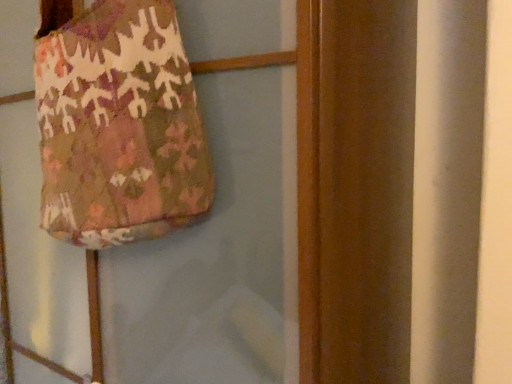
Question: In the image, is textured fabric bag at upper left positioned in front of or behind textured fabric bag at upper left?

Choices:
 (A) behind
 (B) front

Answer: (B)

Question: Is textured fabric bag at upper left inside or outside of textured fabric bag at upper left?

Choices:
 (A) inside
 (B) outside

Answer: (B)

Question: Based on their positions, is textured fabric bag at upper left located to the left or right of textured fabric bag at upper left?

Choices:
 (A) right
 (B) left

Answer: (A)

Question: Looking at the image, does textured fabric bag at upper left seem bigger or smaller compared to textured fabric bag at upper left?

Choices:
 (A) big
 (B) small

Answer: (B)

Question: In terms of width, does textured fabric bag at upper left look wider or thinner when compared to textured fabric bag at upper left?

Choices:
 (A) wide
 (B) thin

Answer: (B)

Question: Is point (128, 19) closer or farther from the camera than point (32, 170)?

Choices:
 (A) closer
 (B) farther

Answer: (A)

Question: From a real-world perspective, relative to textured fabric bag at upper left, is textured fabric bag at upper left vertically above or below?

Choices:
 (A) above
 (B) below

Answer: (A)